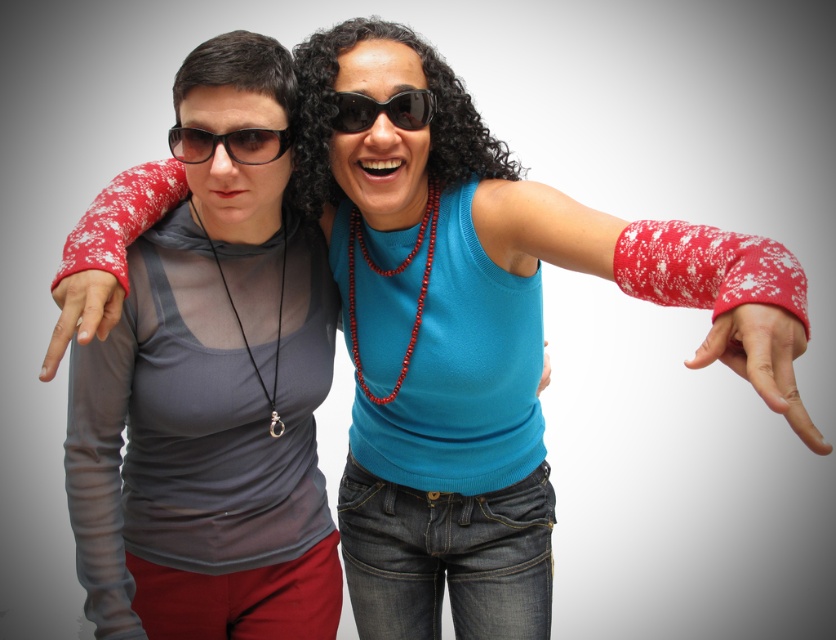
In the scene shown: You are a photographer who wants to ensure the matte gray tank top at left and the red knitted wrist warmer at right are both visible in your photo. Based on their positions, which one is closer to the left edge of the frame?

The matte gray tank top at left is to the left of the red knitted wrist warmer at right, so it is closer to the left edge of the frame.

You are a photographer who wants to adjust the lighting to highlight the red knitted wrist warmer at right without obscuring the black plastic sunglasses at center. Since the wrist warmer is below the sunglasses, where should you place the light source to ensure both items are visible?

The red knitted wrist warmer at right is positioned under the black plastic sunglasses at center. To highlight both items, place the light source above the sunglasses so it can illuminate the wrist warmer below while keeping the sunglasses visible.

You are standing in front of the image and want to describe the position of the matte gray tank top at left relative to the other person. Where is it placed?

The matte gray tank top at left is located at point (209, 424), which places it on the left side of the image, near the upper middle area relative to the other person.